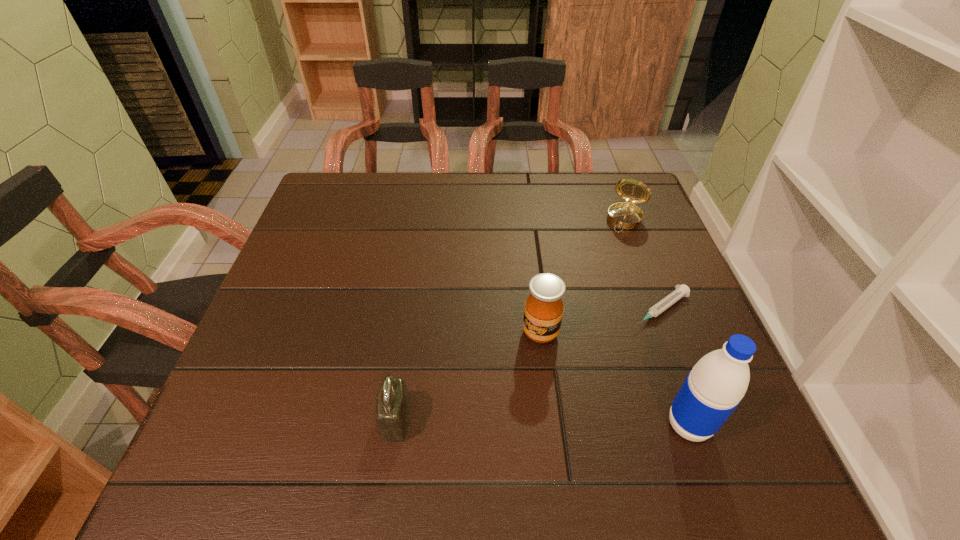
Locate an element on the screen. Image resolution: width=960 pixels, height=540 pixels. free space at the far left corner of the desktop is located at coordinates (374, 173).

Image resolution: width=960 pixels, height=540 pixels. Find the location of `free space between the syringe and the fourth shortest object`. free space between the syringe and the fourth shortest object is located at coordinates (600, 321).

What are the coordinates of `free spot between the second tallest object and the tallest object` in the screenshot? It's located at (614, 379).

Where is `free area in between the shortest object and the second object from left to right`? This screenshot has width=960, height=540. free area in between the shortest object and the second object from left to right is located at coordinates (600, 321).

At what (x,y) coordinates should I click in order to perform the action: click on unoccupied area between the honey and the leftmost object. Please return your answer as a coordinate pair (x, y). Looking at the image, I should click on (468, 376).

The height and width of the screenshot is (540, 960). I want to click on vacant space in between the padlock and the tallest object, so click(x=542, y=422).

This screenshot has height=540, width=960. I want to click on free space between the padlock and the shortest object, so click(x=528, y=364).

Where is `free area in between the syringe and the padlock`? The image size is (960, 540). free area in between the syringe and the padlock is located at coordinates (528, 364).

In order to click on free area in between the compass and the second object from left to right in this screenshot , I will do `click(584, 276)`.

This screenshot has height=540, width=960. Find the location of `free space between the fourth object from right to left and the water bottle`. free space between the fourth object from right to left and the water bottle is located at coordinates (614, 379).